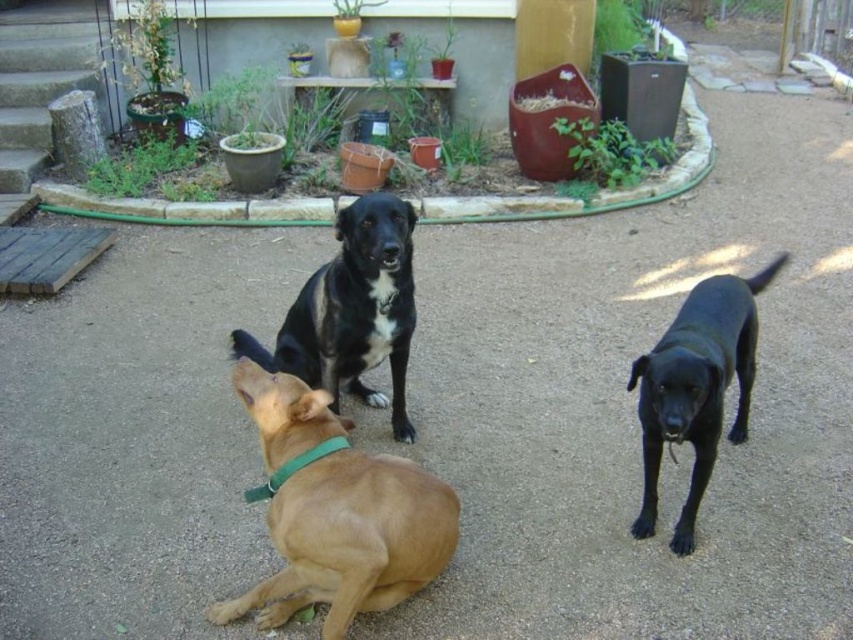
You are a dog owner who wants to buy a new collar for both the black matte dog at center and the black glossy dog at center. The store has collars labeled for small and large dogs. Based on the size difference between them, which collar size should each dog get?

The black matte dog at center is smaller than the black glossy dog at center, so the black matte dog at center should get a small collar and the black glossy dog at center should get a large collar.

Based on the photo, you are a photographer setting up a camera to take a group photo of the golden fur dog at center and the black matte dog at center. Which dog should you position closer to the camera to make them appear the same size in the photo?

Since the golden fur dog at center occupies less space than the black matte dog at center, you should position the golden fur dog at center closer to the camera to make them appear the same size in the photo.